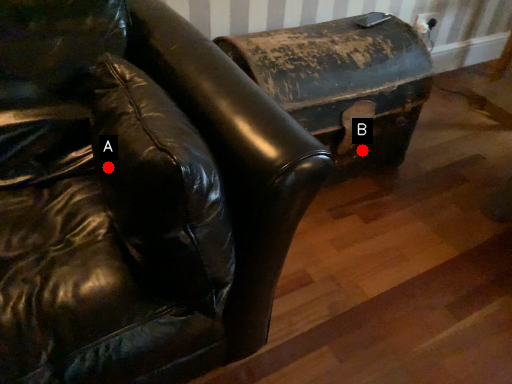
Question: Two points are circled on the image, labeled by A and B beside each circle. Which point is farther to the camera?

Choices:
 (A) A is further
 (B) B is further

Answer: (B)